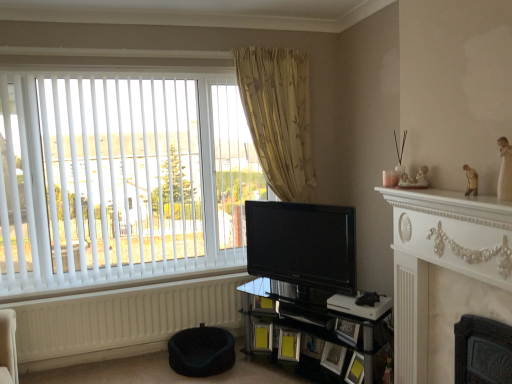
Question: From a real-world perspective, is matte black picture frame at lower center, which is the third picture frame in right-to-left order, beneath matte black picture frame at lower center, the fifth picture frame positioned from the left?

Choices:
 (A) no
 (B) yes

Answer: (B)

Question: Does matte black picture frame at lower center, which is the third picture frame in right-to-left order, have a lesser width compared to matte black picture frame at lower center, positioned as the second picture frame in right-to-left order?

Choices:
 (A) no
 (B) yes

Answer: (A)

Question: From the image's perspective, does matte black picture frame at lower center, which is the fourth picture frame from left to right, appear lower than matte black picture frame at lower center, the fifth picture frame positioned from the left?

Choices:
 (A) no
 (B) yes

Answer: (B)

Question: Is matte black picture frame at lower center, which is the fourth picture frame from left to right, at the left side of matte black picture frame at lower center, the fifth picture frame positioned from the left?

Choices:
 (A) no
 (B) yes

Answer: (B)

Question: Considering the relative positions of matte black picture frame at lower center, which is the third picture frame in right-to-left order, and matte black picture frame at lower center, positioned as the second picture frame in right-to-left order, in the image provided, is matte black picture frame at lower center, which is the third picture frame in right-to-left order, behind matte black picture frame at lower center, positioned as the second picture frame in right-to-left order,?

Choices:
 (A) no
 (B) yes

Answer: (B)

Question: Considering the relative sizes of matte black picture frame at lower center, which is the third picture frame in right-to-left order, and matte black picture frame at lower center, positioned as the second picture frame in right-to-left order, in the image provided, is matte black picture frame at lower center, which is the third picture frame in right-to-left order, bigger than matte black picture frame at lower center, positioned as the second picture frame in right-to-left order,?

Choices:
 (A) no
 (B) yes

Answer: (B)

Question: Does black glass shelf at lower center turn towards white marble fireplace at right?

Choices:
 (A) yes
 (B) no

Answer: (B)

Question: From a real-world perspective, is black glass shelf at lower center located beneath white marble fireplace at right?

Choices:
 (A) yes
 (B) no

Answer: (A)

Question: Considering the relative sizes of black glass shelf at lower center and white marble fireplace at right in the image provided, is black glass shelf at lower center shorter than white marble fireplace at right?

Choices:
 (A) yes
 (B) no

Answer: (B)

Question: Can you confirm if black glass shelf at lower center is bigger than white marble fireplace at right?

Choices:
 (A) yes
 (B) no

Answer: (A)

Question: From the image's perspective, is black glass shelf at lower center located beneath white marble fireplace at right?

Choices:
 (A) no
 (B) yes

Answer: (B)

Question: Considering the relative sizes of black glass shelf at lower center and white marble fireplace at right in the image provided, is black glass shelf at lower center wider than white marble fireplace at right?

Choices:
 (A) yes
 (B) no

Answer: (A)

Question: Does black glossy tv at center lie behind matte black picture frame at lower center, acting as the 3th picture frame starting from the left?

Choices:
 (A) yes
 (B) no

Answer: (B)